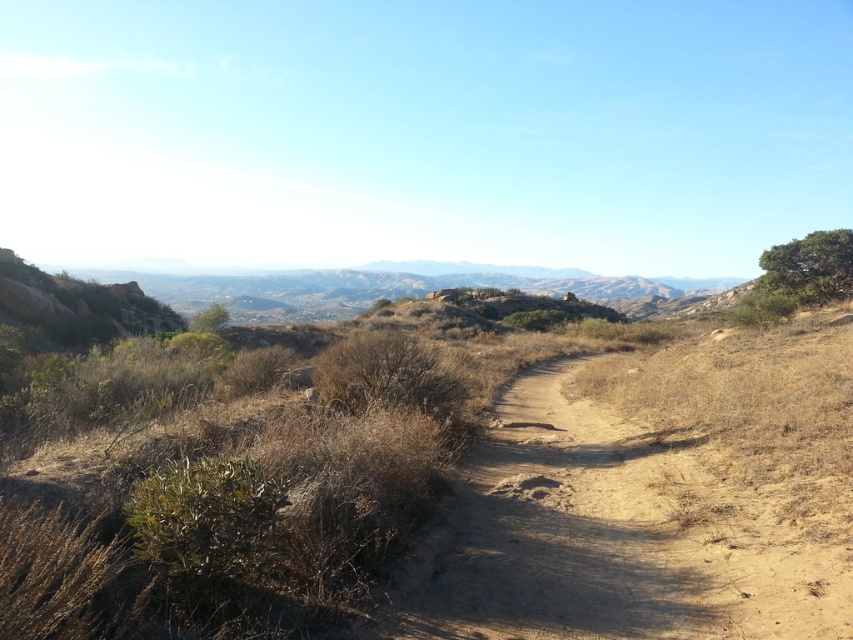
You are a hiker trying to reach the green leafy tree at upper right from the dried dirt path at center. Which direction should you head to reach the tree?

The dried dirt path at center is located below the green leafy tree at upper right, so you should head upwards or towards the upper right direction to reach the tree.

You are standing at the starting point of your journey and see the dried dirt path at center. Based on its 2D coordinates, can you determine if the path is positioned closer to the top or bottom of the image?

The dried dirt path at center is located at coordinates point (553, 536). Since the y coordinate is 0.649, which is closer to 1.0 than to 0.0, the path is positioned closer to the bottom of the image.